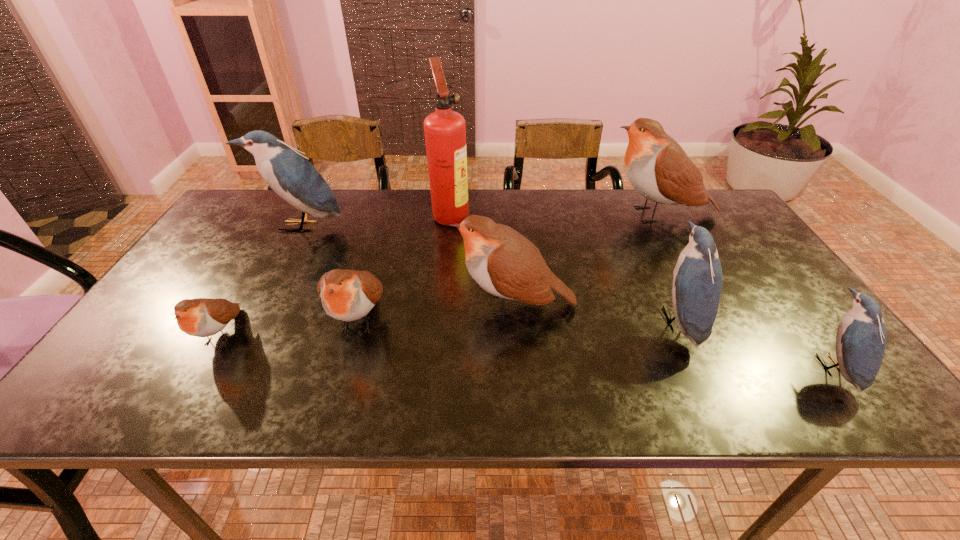
Image resolution: width=960 pixels, height=540 pixels. I want to click on the fifth bird from right to left, so click(347, 295).

This screenshot has width=960, height=540. Identify the location of the rightmost blue bird. (861, 338).

I want to click on the leftmost brown bird, so click(x=201, y=317).

I want to click on the smallest brown bird, so click(201, 317).

The height and width of the screenshot is (540, 960). What are the coordinates of `vacant space located on the front-facing side of the tallest object` in the screenshot? It's located at (564, 214).

You are a GUI agent. You are given a task and a screenshot of the screen. Output one action in this format:
    pyautogui.click(x=<x>, y=<y>)
    Task: Click on the vacant region located 0.360m at the face of the rightmost brown bird
    Image resolution: width=960 pixels, height=540 pixels.
    Given the screenshot: What is the action you would take?
    pyautogui.click(x=488, y=214)

At what (x,y) coordinates should I click in order to perform the action: click on vacant region located at the face of the rightmost brown bird. Please return your answer as a coordinate pair (x, y). Looking at the image, I should click on (586, 214).

Locate an element on the screen. Image resolution: width=960 pixels, height=540 pixels. vacant space situated at the face of the rightmost brown bird is located at coordinates (522, 214).

Locate an element on the screen. This screenshot has height=540, width=960. vacant space located 0.330m at the tip of the biggest blue bird's beak is located at coordinates (251, 317).

At what (x,y) coordinates should I click in order to perform the action: click on blank space located 0.240m at the face of the fourth bird from right to left. Please return your answer as a coordinate pair (x, y). The width and height of the screenshot is (960, 540). Looking at the image, I should click on (356, 305).